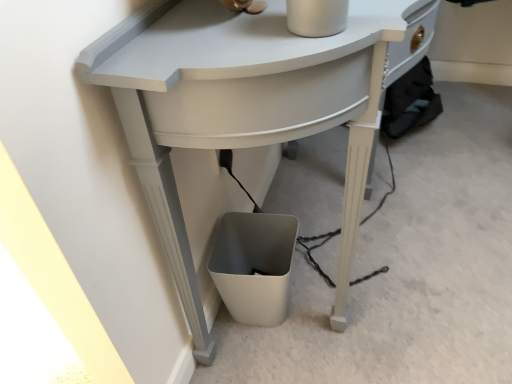
Where is `vacant location below matte white table at center (from a real-world perspective)`? The height and width of the screenshot is (384, 512). vacant location below matte white table at center (from a real-world perspective) is located at coordinates (331, 246).